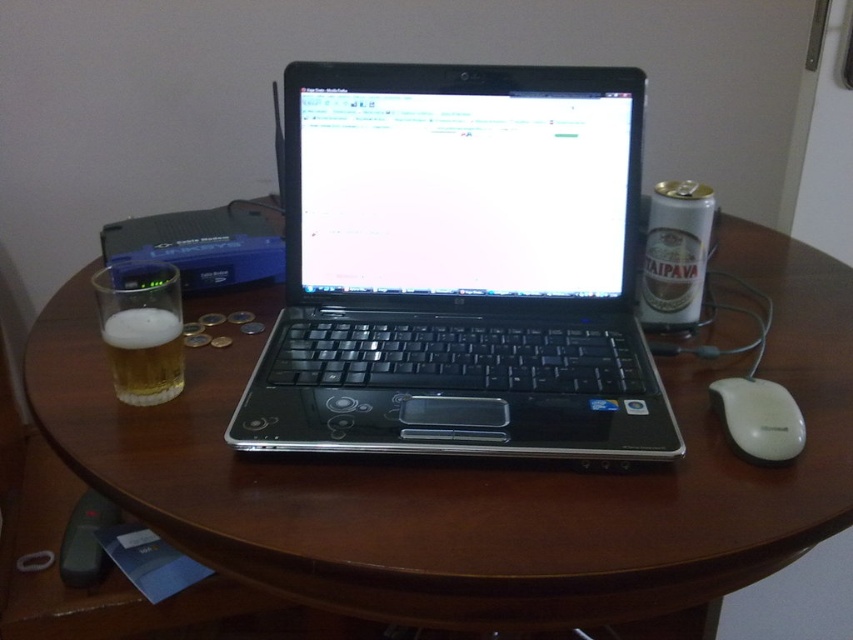
Between brown wood round table at center and foamy golden beer at left, which one has less height?

foamy golden beer at left

Consider the image. Can you confirm if brown wood round table at center is wider than foamy golden beer at left?

Indeed, brown wood round table at center has a greater width compared to foamy golden beer at left.

At what (x,y) coordinates should I click in order to perform the action: click on brown wood round table at center. Please return your answer as a coordinate pair (x, y). This screenshot has width=853, height=640. Looking at the image, I should click on (471, 476).

At what (x,y) coordinates should I click in order to perform the action: click on brown wood round table at center. Please return your answer as a coordinate pair (x, y). The image size is (853, 640). Looking at the image, I should click on (471, 476).

Does black plastic laptop at center have a greater height compared to foamy golden beer at left?

Yes.

Is point (610, 326) less distant than point (172, 312)?

No, it is behind (172, 312).

In order to click on black plastic laptop at center in this screenshot , I will do `click(459, 268)`.

Is brown wood round table at center to the right of black plastic laptop at center from the viewer's perspective?

Correct, you'll find brown wood round table at center to the right of black plastic laptop at center.

Between point (695, 524) and point (277, 371), which one is positioned in front?

Point (695, 524) is in front.

Find the location of a particular element. This screenshot has width=853, height=640. brown wood round table at center is located at coordinates point(471,476).